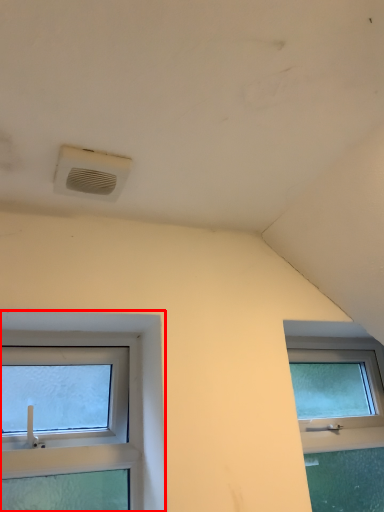
Question: From the image's perspective, considering the relative positions of window (annotated by the red box) and air conditioning in the image provided, where is window (annotated by the red box) located with respect to the staircase?

Choices:
 (A) below
 (B) above

Answer: (A)